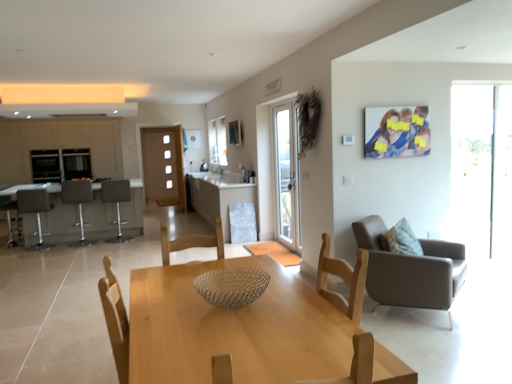
Question: From a real-world perspective, is gray fabric bar stool at left, the second chair positioned from the right, over matte white cabinetry at left?

Choices:
 (A) yes
 (B) no

Answer: (B)

Question: Is gray fabric bar stool at left, the second chair positioned from the right, outside matte white cabinetry at left?

Choices:
 (A) no
 (B) yes

Answer: (B)

Question: Considering the relative sizes of gray fabric bar stool at left, marked as the 1th chair in a back-to-front arrangement, and matte white cabinetry at left in the image provided, is gray fabric bar stool at left, marked as the 1th chair in a back-to-front arrangement, thinner than matte white cabinetry at left?

Choices:
 (A) no
 (B) yes

Answer: (B)

Question: Does gray fabric bar stool at left, the third chair from the left, lie behind matte white cabinetry at left?

Choices:
 (A) no
 (B) yes

Answer: (A)

Question: Is gray fabric bar stool at left, marked as the 1th chair in a back-to-front arrangement, oriented towards matte white cabinetry at left?

Choices:
 (A) no
 (B) yes

Answer: (B)

Question: Considering the relative sizes of gray fabric bar stool at left, marked as the 1th chair in a back-to-front arrangement, and matte white cabinetry at left in the image provided, is gray fabric bar stool at left, marked as the 1th chair in a back-to-front arrangement, wider than matte white cabinetry at left?

Choices:
 (A) yes
 (B) no

Answer: (B)

Question: Is matte gray bar stool at left, the second chair in the front-to-back sequence, wider than matte plastic photo frame at upper right?

Choices:
 (A) no
 (B) yes

Answer: (B)

Question: Is matte gray bar stool at left, the second chair in the front-to-back sequence, turned away from matte plastic photo frame at upper right?

Choices:
 (A) yes
 (B) no

Answer: (B)

Question: From a real-world perspective, is matte gray bar stool at left, the second chair in the front-to-back sequence, on matte plastic photo frame at upper right?

Choices:
 (A) yes
 (B) no

Answer: (B)

Question: Is matte gray bar stool at left, the second chair in the front-to-back sequence, taller than matte plastic photo frame at upper right?

Choices:
 (A) yes
 (B) no

Answer: (A)

Question: Does matte gray bar stool at left, the third chair in the back-to-front sequence, lie in front of matte plastic photo frame at upper right?

Choices:
 (A) no
 (B) yes

Answer: (A)

Question: Does matte gray bar stool at left, which appears as the fourth chair when viewed from the right, have a smaller size compared to matte plastic photo frame at upper right?

Choices:
 (A) no
 (B) yes

Answer: (A)

Question: From a real-world perspective, is matte white cabinetry at left positioned under white marble table at center, which is the first table in right-to-left order, based on gravity?

Choices:
 (A) no
 (B) yes

Answer: (A)